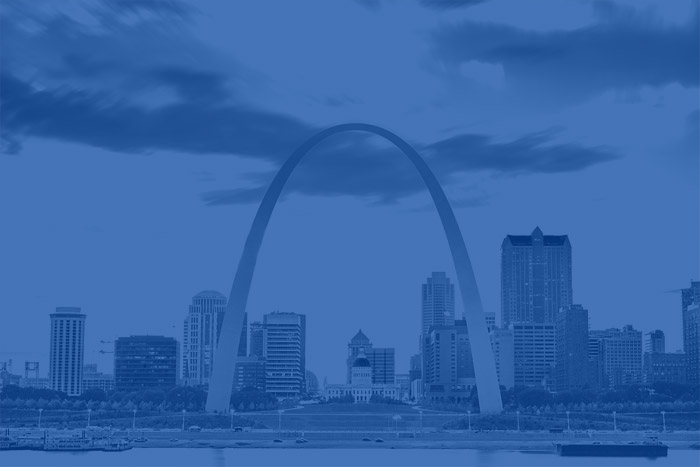
Where is `top of arch`? Image resolution: width=700 pixels, height=467 pixels. top of arch is located at coordinates (348, 130).